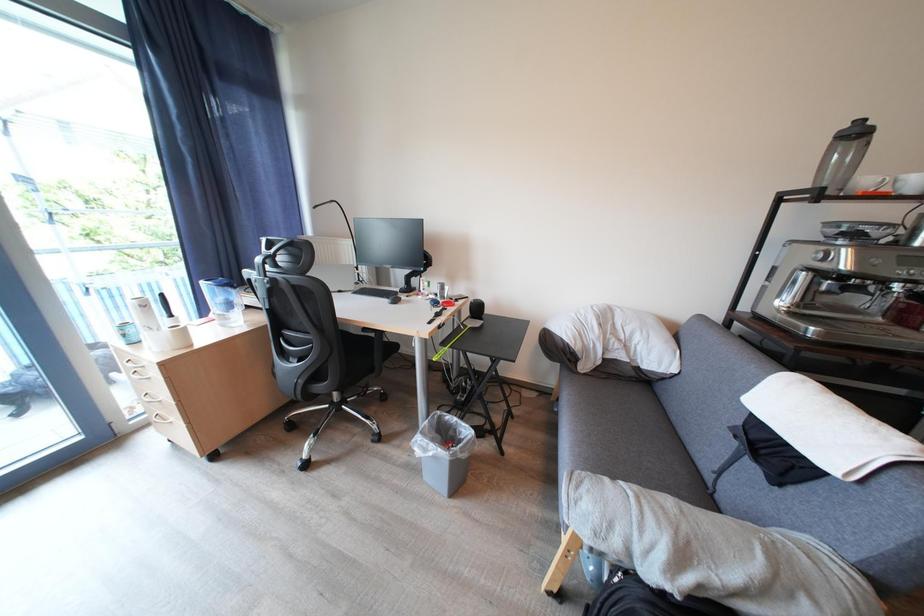
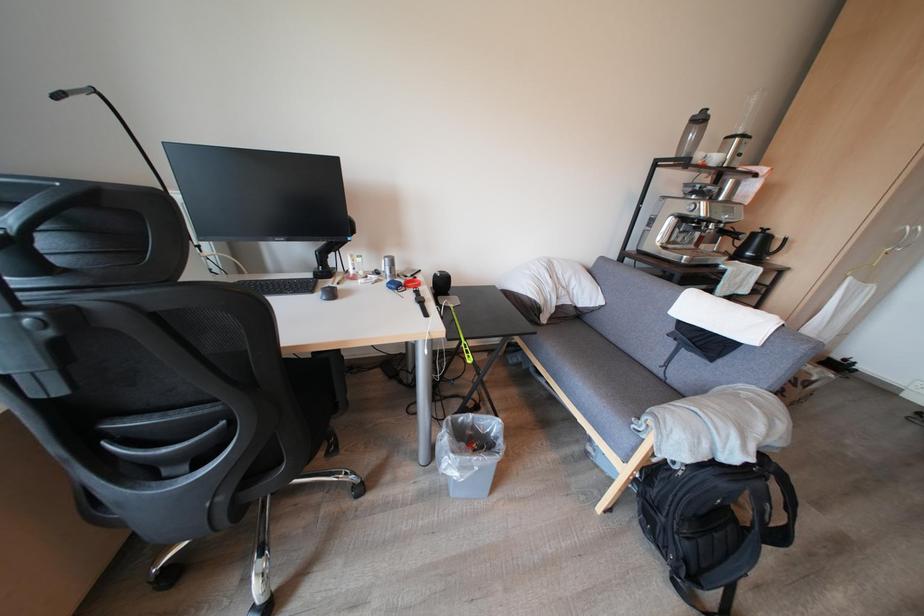
Question: The images are taken continuously from a first-person perspective. In which direction is your viewpoint rotating?

Choices:
 (A) Left
 (B) Right
 (C) Up
 (D) Down

Answer: (B)